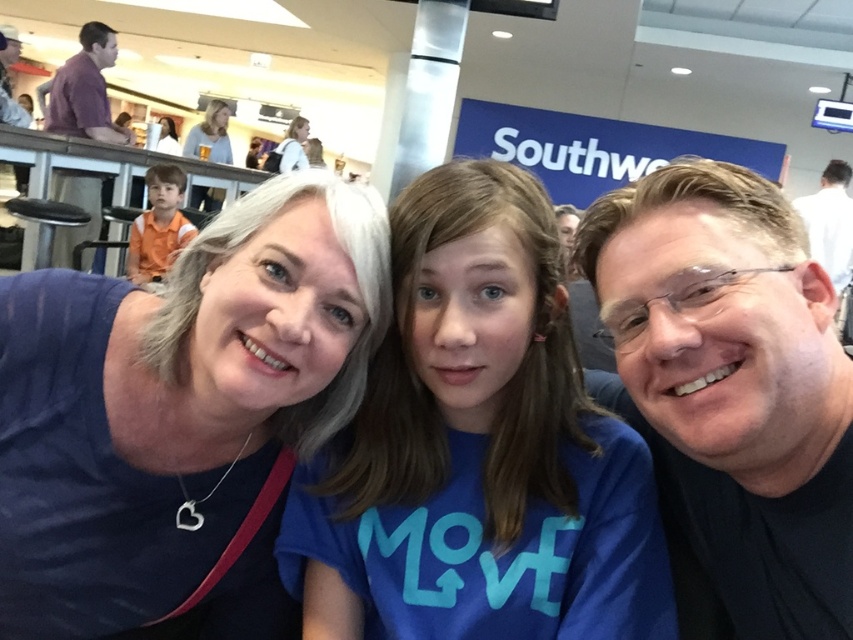
Question: Is blue cotton shirt at center further to the viewer compared to matte black shirt at center?

Choices:
 (A) no
 (B) yes

Answer: (B)

Question: Does matte black shirt at center appear over matte white hair at upper center?

Choices:
 (A) no
 (B) yes

Answer: (A)

Question: Which point appears closest to the camera in this image?

Choices:
 (A) (67, 536)
 (B) (170, 138)
 (C) (277, 148)

Answer: (A)

Question: Based on their relative distances, which object is farther from the matte white hair at upper center?

Choices:
 (A) matte black backpack at upper center
 (B) matte blue shirt at center

Answer: (B)

Question: Which of the following is the closest to the observer?

Choices:
 (A) purple shirt at upper left
 (B) white fabric at upper center
 (C) matte blue shirt at center

Answer: (C)

Question: Can you confirm if matte black shirt at center is thinner than purple shirt at upper left?

Choices:
 (A) no
 (B) yes

Answer: (B)